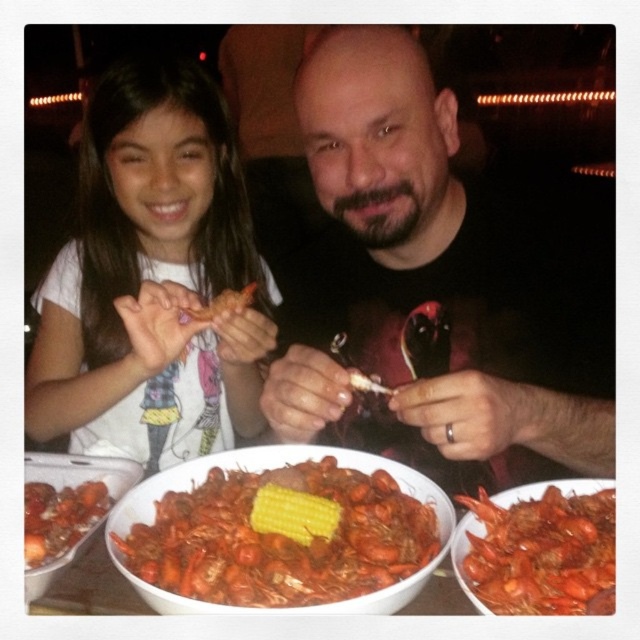
Can you confirm if shiny orange crawfish at center is taller than shiny red crawfish at lower left?

Indeed, shiny orange crawfish at center has a greater height compared to shiny red crawfish at lower left.

Does shiny orange crawfish at center have a larger size compared to shiny red crawfish at lower left?

Yes, shiny orange crawfish at center is bigger than shiny red crawfish at lower left.

Measure the distance between point (538, 516) and camera.

Point (538, 516) and camera are 26.41 inches apart.

Identify the location of shiny orange crawfish at center. (540, 552).

Is shiny orange crawfish at center to the right of yellow matte corn at center from the viewer's perspective?

Indeed, shiny orange crawfish at center is positioned on the right side of yellow matte corn at center.

Who is more forward, (x=470, y=508) or (x=296, y=504)?

Positioned in front is point (x=296, y=504).

Identify the location of shiny orange crawfish at center. (540, 552).

Looking at this image, how distant is smooth black shirt at center from orange glossy crawfish at center?

They are 11.20 inches apart.

Is smooth black shirt at center above orange glossy crawfish at center?

Indeed, smooth black shirt at center is positioned over orange glossy crawfish at center.

Is point (582, 356) positioned after point (234, 301)?

That is False.

Where is `smooth black shirt at center`? The image size is (640, 640). smooth black shirt at center is located at coordinates (442, 284).